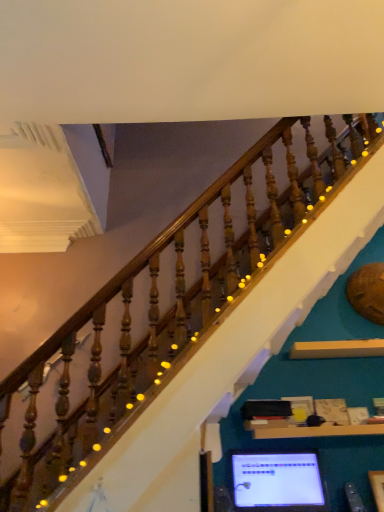
What is the approximate width of matte white monitor at lower right?

matte white monitor at lower right is 6.34 inches in width.

What is the approximate height of matte white monitor at lower right?

15.74 inches.

Find the location of a particular element. The height and width of the screenshot is (512, 384). matte white monitor at lower right is located at coordinates (277, 481).

This screenshot has height=512, width=384. Describe the element at coordinates (277, 481) in the screenshot. I see `matte white monitor at lower right` at that location.

I want to click on matte white monitor at lower right, so click(277, 481).